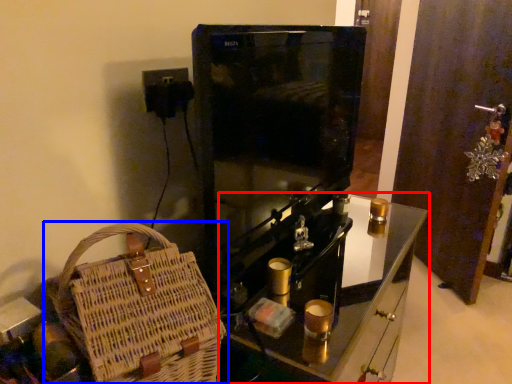
Question: Which point is closer to the camera, furniture (highlighted by a red box) or handbag (highlighted by a blue box)?

Choices:
 (A) furniture
 (B) handbag

Answer: (B)